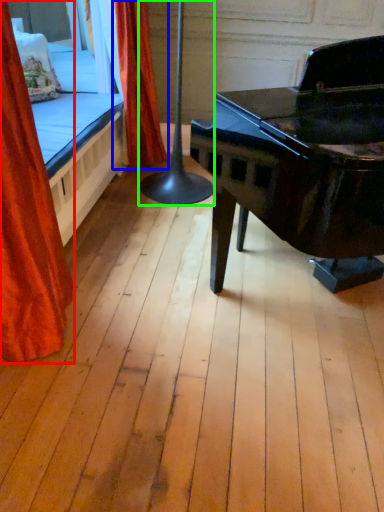
Question: Which object is the closest to the curtain (highlighted by a red box)? Choose among these: curtain (highlighted by a blue box) or table lamp (highlighted by a green box).

Choices:
 (A) curtain
 (B) table lamp

Answer: (B)